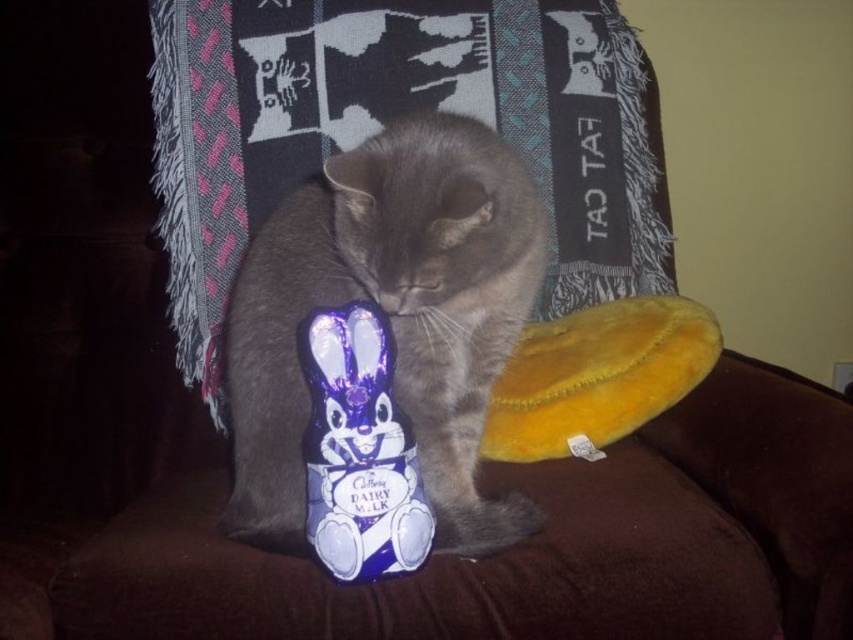
Question: Is gray fur cat at center wider than blue shiny chocolate at center?

Choices:
 (A) no
 (B) yes

Answer: (B)

Question: Which point is closer to the camera?

Choices:
 (A) (263, 467)
 (B) (339, 483)

Answer: (B)

Question: Is gray fur cat at center in front of blue shiny chocolate at center?

Choices:
 (A) yes
 (B) no

Answer: (A)

Question: Does gray fur cat at center appear on the right side of blue shiny chocolate at center?

Choices:
 (A) yes
 (B) no

Answer: (A)

Question: Which of the following is the closest to the observer?

Choices:
 (A) gray fur cat at center
 (B) blue shiny chocolate at center

Answer: (A)